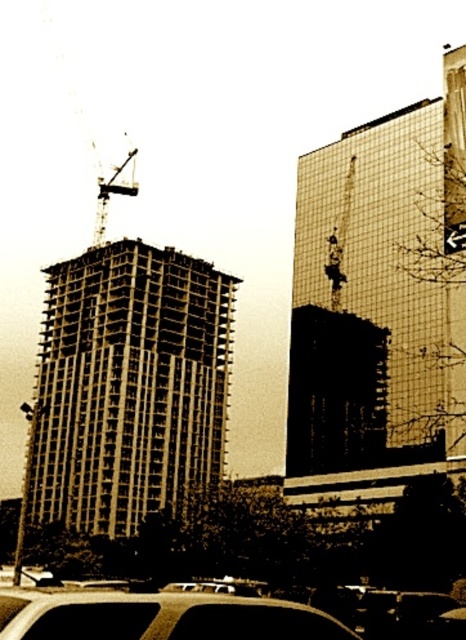
Question: Considering the relative positions of reflective glass building at center and concrete frame building at left in the image provided, where is reflective glass building at center located with respect to concrete frame building at left?

Choices:
 (A) above
 (B) below

Answer: (A)

Question: Does concrete frame building at left appear over black glossy car at lower center?

Choices:
 (A) yes
 (B) no

Answer: (B)

Question: Which of the following is the farthest from the observer?

Choices:
 (A) black glossy car at lower center
 (B) metallic construction crane at upper left

Answer: (B)

Question: Which of these objects is positioned closest to the concrete frame building at left?

Choices:
 (A) reflective glass building at center
 (B) black glossy car at lower center
 (C) metallic construction crane at upper left

Answer: (C)

Question: Which point appears farthest from the camera in this image?

Choices:
 (A) (334, 637)
 (B) (102, 184)

Answer: (B)

Question: Does black glossy car at lower center lie in front of metallic construction crane at upper left?

Choices:
 (A) yes
 (B) no

Answer: (A)